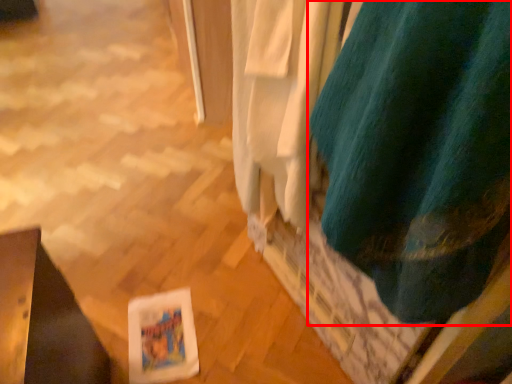
Question: In this image, where is curtain (annotated by the red box) located relative to curtain?

Choices:
 (A) left
 (B) right

Answer: (B)